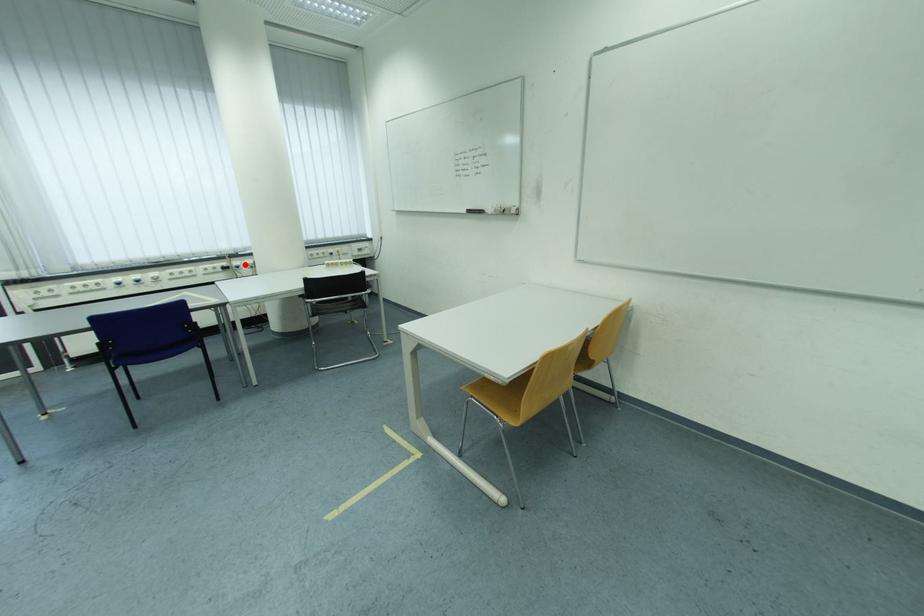
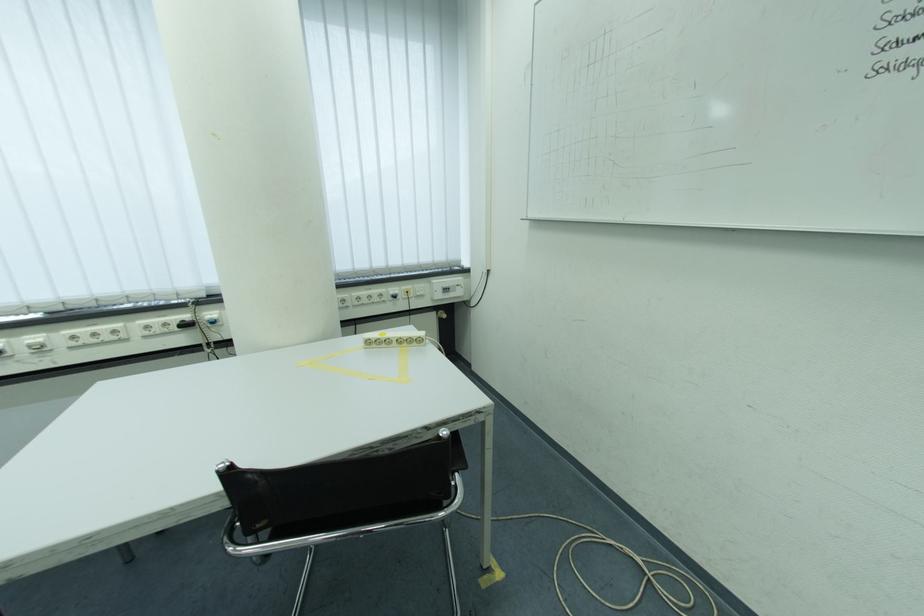
Question: I am providing you with two images of the same scene from different viewpoints. Given a red point in image1, look at the same physical point in image2. Is it:

Choices:
 (A) Closer to the viewpoint
 (B) Farther from the viewpoint

Answer: (B)